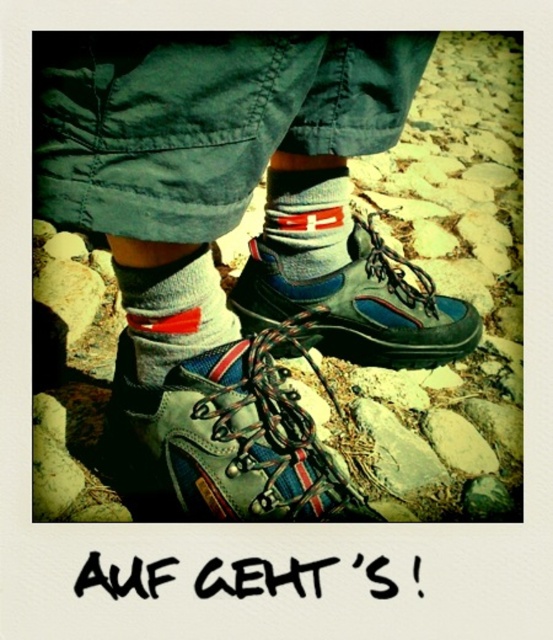
Can you confirm if leather hiking boot at center is positioned to the right of gray cotton sock at center?

Incorrect, leather hiking boot at center is not on the right side of gray cotton sock at center.

Is leather hiking boot at center positioned in front of gray cotton sock at center?

That is True.

Is point (137, 481) closer to camera compared to point (302, 278)?

That is True.

Locate an element on the screen. This screenshot has width=553, height=640. leather hiking boot at center is located at coordinates coord(226,438).

Can you confirm if matte gray hiking boots at center is positioned to the left of leather hiking boot at center?

Incorrect, matte gray hiking boots at center is not on the left side of leather hiking boot at center.

Describe the element at coordinates (249, 243) in the screenshot. This screenshot has width=553, height=640. I see `matte gray hiking boots at center` at that location.

What are the coordinates of `matte gray hiking boots at center` in the screenshot? It's located at (249, 243).

Does leather hiking boot at center appear under white textured sock at center?

Indeed, leather hiking boot at center is positioned under white textured sock at center.

In the scene shown: Who is taller, leather hiking boot at center or white textured sock at center?

With more height is leather hiking boot at center.

Who is more distant from viewer, (192, 387) or (180, 301)?

The point (192, 387) is more distant.

Locate an element on the screen. The height and width of the screenshot is (640, 553). leather hiking boot at center is located at coordinates (226, 438).